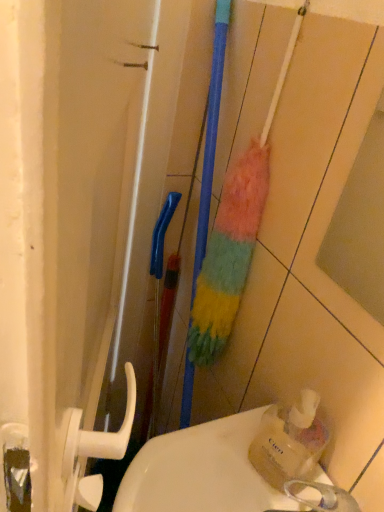
Question: From the image's perspective, is white glossy sink at lower center over multicolored fuzzy brush at center?

Choices:
 (A) yes
 (B) no

Answer: (B)

Question: From a real-world perspective, is white glossy sink at lower center on top of multicolored fuzzy brush at center?

Choices:
 (A) no
 (B) yes

Answer: (A)

Question: From a real-world perspective, is white glossy sink at lower center physically below multicolored fuzzy brush at center?

Choices:
 (A) yes
 (B) no

Answer: (A)

Question: Is white glossy sink at lower center at the left side of multicolored fuzzy brush at center?

Choices:
 (A) no
 (B) yes

Answer: (B)

Question: Can you confirm if white glossy sink at lower center is taller than multicolored fuzzy brush at center?

Choices:
 (A) yes
 (B) no

Answer: (B)

Question: Considering the positions of translucent plastic soap dispenser at lower right and white glossy sink at lower center in the image, is translucent plastic soap dispenser at lower right taller or shorter than white glossy sink at lower center?

Choices:
 (A) tall
 (B) short

Answer: (A)

Question: Relative to white glossy sink at lower center, is translucent plastic soap dispenser at lower right in front or behind?

Choices:
 (A) front
 (B) behind

Answer: (B)

Question: Considering the positions of translucent plastic soap dispenser at lower right and white glossy sink at lower center in the image, is translucent plastic soap dispenser at lower right wider or thinner than white glossy sink at lower center?

Choices:
 (A) thin
 (B) wide

Answer: (A)

Question: Is translucent plastic soap dispenser at lower right to the left or to the right of white glossy sink at lower center in the image?

Choices:
 (A) right
 (B) left

Answer: (A)

Question: From a real-world perspective, relative to translucent plastic soap dispenser at lower right, is multicolored fuzzy brush at center vertically above or below?

Choices:
 (A) below
 (B) above

Answer: (B)

Question: From the image's perspective, relative to translucent plastic soap dispenser at lower right, is multicolored fuzzy brush at center above or below?

Choices:
 (A) below
 (B) above

Answer: (B)

Question: Is multicolored fuzzy brush at center wider or thinner than translucent plastic soap dispenser at lower right?

Choices:
 (A) wide
 (B) thin

Answer: (A)

Question: Choose the correct answer: Is multicolored fuzzy brush at center inside translucent plastic soap dispenser at lower right or outside it?

Choices:
 (A) outside
 (B) inside

Answer: (A)

Question: Considering the relative positions of translucent plastic soap dispenser at lower right and multicolored fuzzy brush at center in the image provided, is translucent plastic soap dispenser at lower right to the left or to the right of multicolored fuzzy brush at center?

Choices:
 (A) left
 (B) right

Answer: (B)

Question: Does point (269, 437) appear closer or farther from the camera than point (235, 203)?

Choices:
 (A) closer
 (B) farther

Answer: (A)